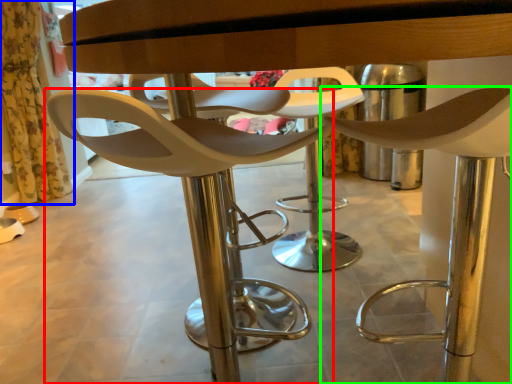
Question: Which object is the closest to the chair (highlighted by a red box)? Choose among these: curtain (highlighted by a blue box) or chair (highlighted by a green box).

Choices:
 (A) curtain
 (B) chair

Answer: (B)